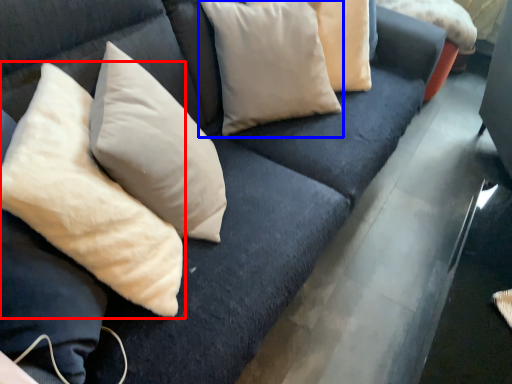
Question: Which object is further to the camera taking this photo, pillow (highlighted by a red box) or pillow (highlighted by a blue box)?

Choices:
 (A) pillow
 (B) pillow

Answer: (B)